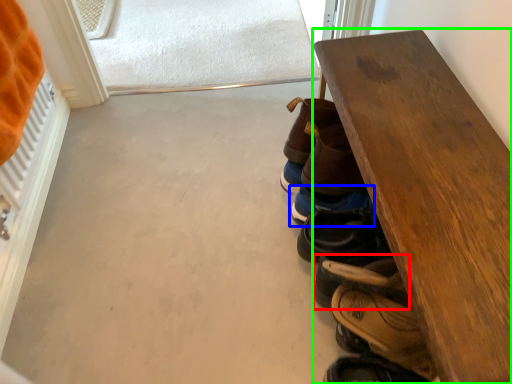
Question: Which is farther away from footwear (highlighted by a red box)? footwear (highlighted by a blue box) or table (highlighted by a green box)?

Choices:
 (A) footwear
 (B) table

Answer: (B)